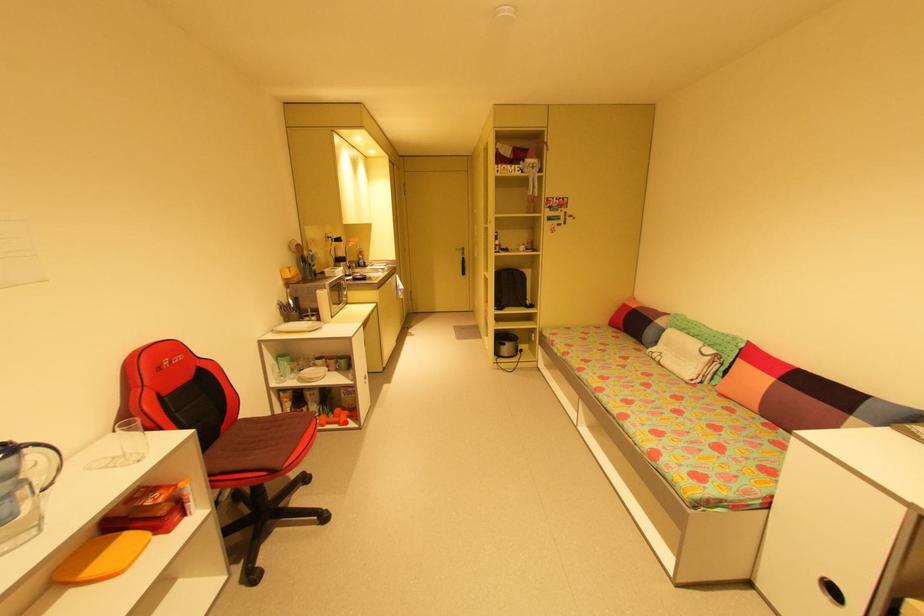
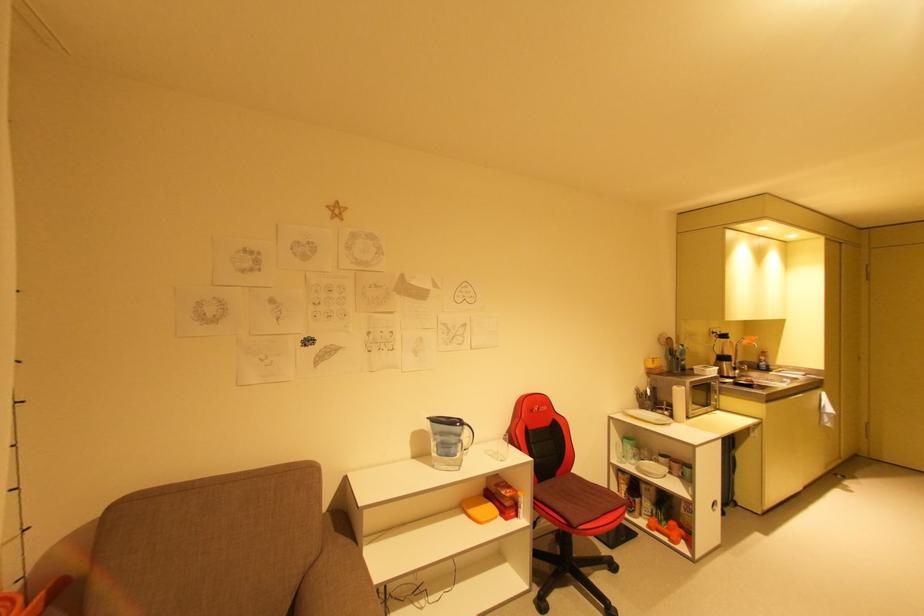
Question: I am providing you with two images of the same scene from different viewpoints. Given a red point in image1, look at the same physical point in image2. Is it:

Choices:
 (A) Closer to the viewpoint
 (B) Farther from the viewpoint

Answer: (B)